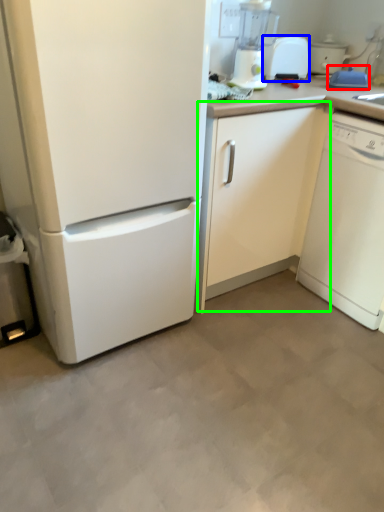
Question: Which object is positioned farthest from appliance (highlighted by a red box)? Select from toaster (highlighted by a blue box) and cabinetry (highlighted by a green box).

Choices:
 (A) toaster
 (B) cabinetry

Answer: (B)